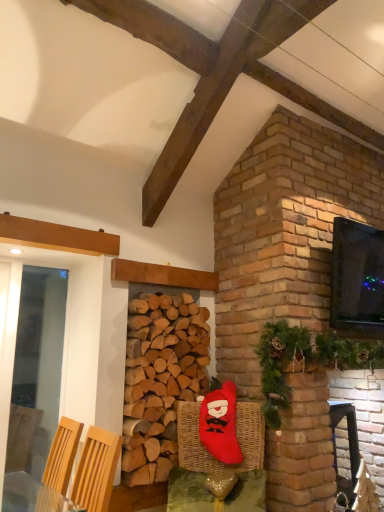
Question: Should I look upward or downward to see woven wicker armchair at lower right, the first armchair in the right-to-left sequence?

Choices:
 (A) up
 (B) down

Answer: (B)

Question: From the image's perspective, is black glossy tv at upper right beneath transparent glass door at left?

Choices:
 (A) no
 (B) yes

Answer: (A)

Question: Can you confirm if black glossy tv at upper right is taller than transparent glass door at left?

Choices:
 (A) no
 (B) yes

Answer: (A)

Question: Is black glossy tv at upper right thinner than transparent glass door at left?

Choices:
 (A) no
 (B) yes

Answer: (A)

Question: Is black glossy tv at upper right touching transparent glass door at left?

Choices:
 (A) yes
 (B) no

Answer: (B)

Question: Is black glossy tv at upper right positioned before transparent glass door at left?

Choices:
 (A) yes
 (B) no

Answer: (B)

Question: Is black glossy tv at upper right to the left of transparent glass door at left from the viewer's perspective?

Choices:
 (A) yes
 (B) no

Answer: (B)

Question: Considering the relative sizes of red plush santa at center and woven wicker armchair at lower right, marked as the second armchair in a left-to-right arrangement, in the image provided, is red plush santa at center taller than woven wicker armchair at lower right, marked as the second armchair in a left-to-right arrangement,?

Choices:
 (A) no
 (B) yes

Answer: (B)

Question: Is red plush santa at center not close to woven wicker armchair at lower right, the first armchair in the right-to-left sequence?

Choices:
 (A) yes
 (B) no

Answer: (A)

Question: Can you confirm if red plush santa at center is smaller than woven wicker armchair at lower right, the second armchair from the front?

Choices:
 (A) yes
 (B) no

Answer: (B)

Question: From a real-world perspective, is red plush santa at center positioned under woven wicker armchair at lower right, which is counted as the first armchair, starting from the back, based on gravity?

Choices:
 (A) no
 (B) yes

Answer: (A)

Question: Can you confirm if red plush santa at center is positioned to the left of woven wicker armchair at lower right, the second armchair from the front?

Choices:
 (A) yes
 (B) no

Answer: (A)

Question: Considering the relative sizes of red plush santa at center and woven wicker armchair at lower right, which is counted as the first armchair, starting from the back, in the image provided, is red plush santa at center shorter than woven wicker armchair at lower right, which is counted as the first armchair, starting from the back,?

Choices:
 (A) no
 (B) yes

Answer: (A)

Question: From a real-world perspective, does natural brown wood at center stand above woven wicker basket at lower center?

Choices:
 (A) no
 (B) yes

Answer: (B)